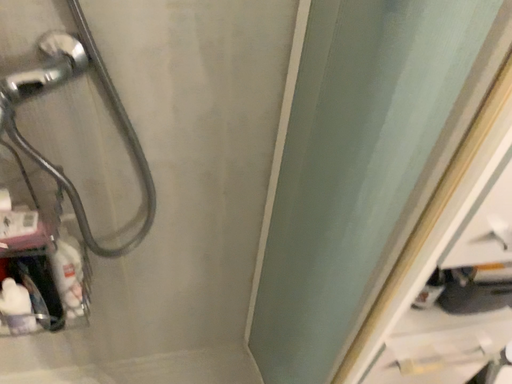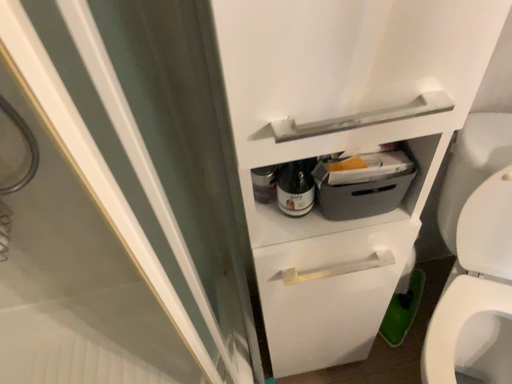
Question: Which way did the camera rotate in the video?

Choices:
 (A) rotated upward
 (B) rotated downward

Answer: (B)